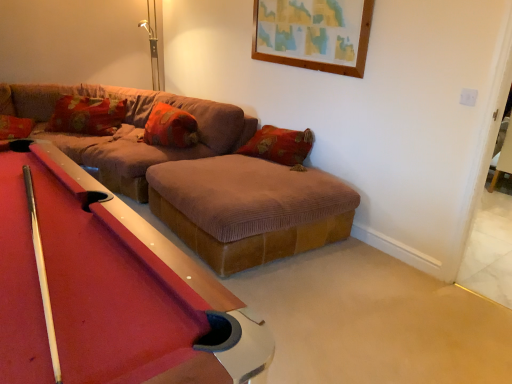
Question: From the image's perspective, is brown corduroy couch at center located beneath velvet orange pillow at center, acting as the first pillow starting from the right?

Choices:
 (A) yes
 (B) no

Answer: (A)

Question: Does brown corduroy couch at center have a lesser height compared to velvet orange pillow at center, marked as the second pillow in a left-to-right arrangement?

Choices:
 (A) yes
 (B) no

Answer: (B)

Question: Does brown corduroy couch at center have a lesser width compared to velvet orange pillow at center, marked as the second pillow in a left-to-right arrangement?

Choices:
 (A) no
 (B) yes

Answer: (A)

Question: Is brown corduroy couch at center positioned behind velvet orange pillow at center, acting as the first pillow starting from the right?

Choices:
 (A) no
 (B) yes

Answer: (A)

Question: Is brown corduroy couch at center smaller than velvet orange pillow at center, marked as the second pillow in a left-to-right arrangement?

Choices:
 (A) yes
 (B) no

Answer: (B)

Question: From a real-world perspective, relative to corduroy pillow at upper left, which is the 1th pillow in left-to-right order, is rubberized felt pool table at center vertically above or below?

Choices:
 (A) above
 (B) below

Answer: (B)

Question: From the image's perspective, is rubberized felt pool table at center positioned above or below corduroy pillow at upper left, which is the 1th pillow in left-to-right order?

Choices:
 (A) above
 (B) below

Answer: (B)

Question: In terms of width, does rubberized felt pool table at center look wider or thinner when compared to corduroy pillow at upper left, which is the 1th pillow in left-to-right order?

Choices:
 (A) thin
 (B) wide

Answer: (B)

Question: Relative to corduroy pillow at upper left, marked as the second pillow in a right-to-left arrangement, is rubberized felt pool table at center in front or behind?

Choices:
 (A) behind
 (B) front

Answer: (B)

Question: From a real-world perspective, is corduroy pillow at upper left, which is the 1th pillow in left-to-right order, above or below rubberized felt pool table at center?

Choices:
 (A) below
 (B) above

Answer: (B)

Question: Is point (67, 107) positioned closer to the camera than point (128, 380)?

Choices:
 (A) farther
 (B) closer

Answer: (A)

Question: Is corduroy pillow at upper left, which is the 1th pillow in left-to-right order, inside or outside of rubberized felt pool table at center?

Choices:
 (A) outside
 (B) inside

Answer: (A)

Question: Is corduroy pillow at upper left, which is the 1th pillow in left-to-right order, taller or shorter than rubberized felt pool table at center?

Choices:
 (A) short
 (B) tall

Answer: (A)

Question: Is point (155, 299) positioned closer to the camera than point (33, 104)?

Choices:
 (A) closer
 (B) farther

Answer: (A)

Question: Is rubberized felt pool table at center in front of or behind brown corduroy couch at center in the image?

Choices:
 (A) front
 (B) behind

Answer: (A)